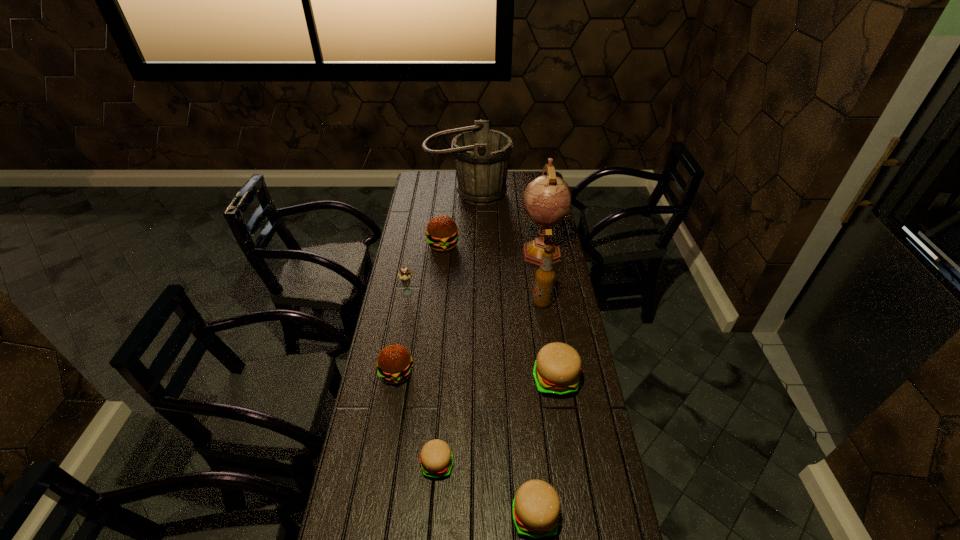
Locate an element on the screen. This screenshot has width=960, height=540. object identified as the eighth closest to the bigger brown hamburger is located at coordinates 536,506.

This screenshot has height=540, width=960. I want to click on hamburger that is the second nearest to the nearest object, so click(557, 368).

Identify which hamburger is the fourth nearest to the seventh shortest object. Please provide its 2D coordinates. Your answer should be formatted as a tuple, i.e. [(x, y)], where the tuple contains the x and y coordinates of a point satisfying the conditions above.

[(436, 460)]

Select which brown hamburger appears as the closest to the farthest beige hamburger. Please provide its 2D coordinates. Your answer should be formatted as a tuple, i.e. [(x, y)], where the tuple contains the x and y coordinates of a point satisfying the conditions above.

[(394, 362)]

The width and height of the screenshot is (960, 540). Identify the location of brown hamburger that is the nearest to the pink globe. (442, 235).

Locate which beige hamburger is the third closest to the beer bottle. Please provide its 2D coordinates. Your answer should be formatted as a tuple, i.e. [(x, y)], where the tuple contains the x and y coordinates of a point satisfying the conditions above.

[(536, 506)]

This screenshot has width=960, height=540. I want to click on beige hamburger identified as the closest to the second smallest beige hamburger, so click(x=436, y=460).

Locate an element on the screen. This screenshot has width=960, height=540. blank area in the image that satisfies the following two spatial constraints: 1. on the handle side of the biggest beige hamburger; 2. on the right side of the farthest object is located at coordinates (461, 380).

Find the location of a particular element. The height and width of the screenshot is (540, 960). vacant area in the image that satisfies the following two spatial constraints: 1. on the handle side of the biggest beige hamburger; 2. on the right side of the farthest object is located at coordinates (461, 380).

Image resolution: width=960 pixels, height=540 pixels. I want to click on blank area in the image that satisfies the following two spatial constraints: 1. on the handle side of the bucket; 2. on the left side of the farthest beige hamburger, so click(x=461, y=380).